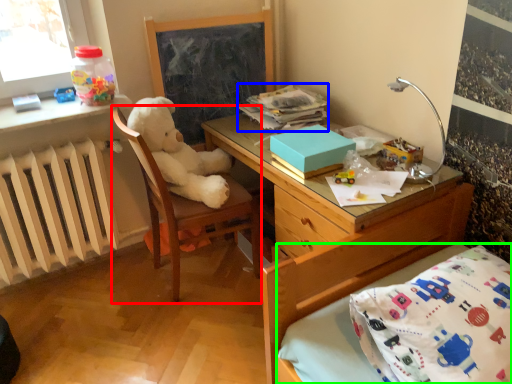
Question: Based on their relative distances, which object is nearer to chair (highlighted by a red box)? Choose from book (highlighted by a blue box) and bed frame (highlighted by a green box).

Choices:
 (A) book
 (B) bed frame

Answer: (A)